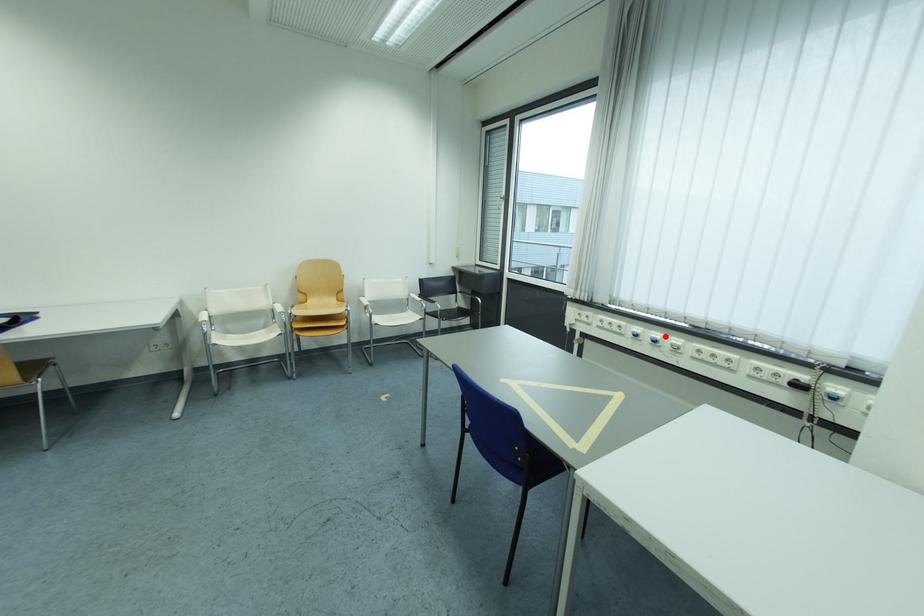
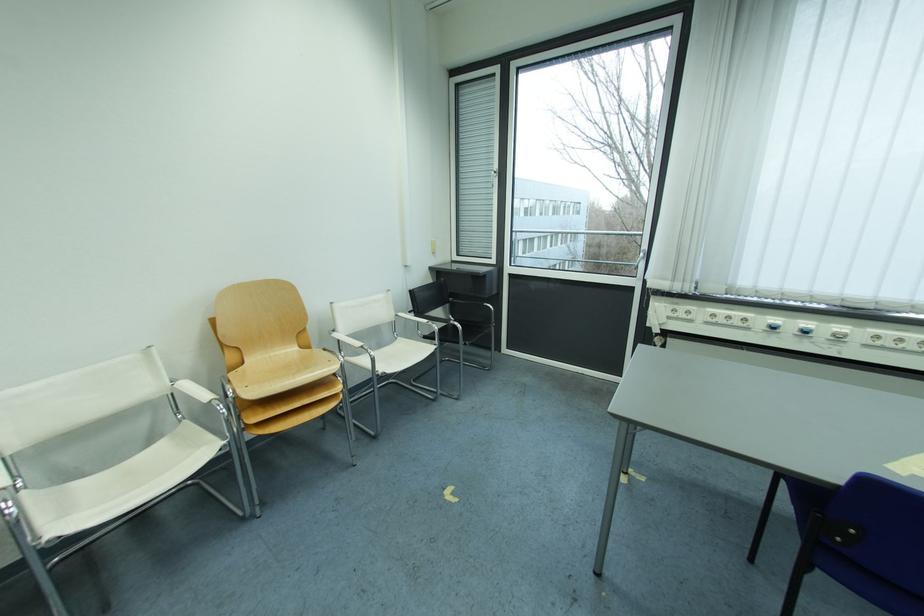
Where in the second image is the point corresponding to the highlighted location from the first image?

(816, 326)